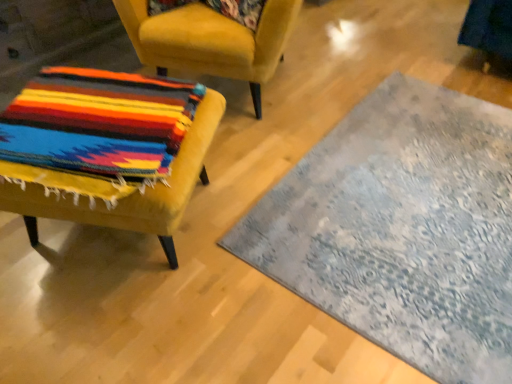
Image resolution: width=512 pixels, height=384 pixels. I want to click on free spot above textured gray rug at center (from a real-world perspective), so click(x=425, y=214).